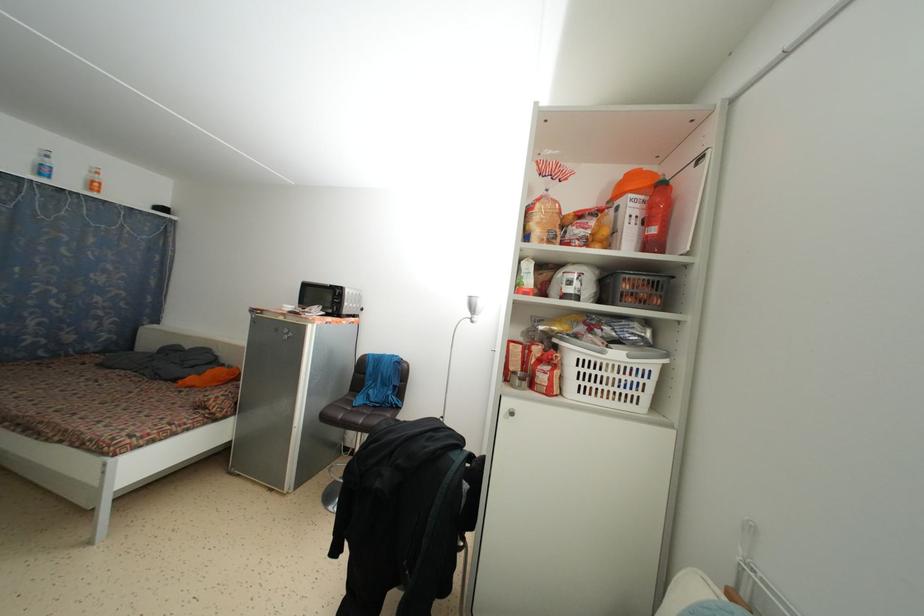
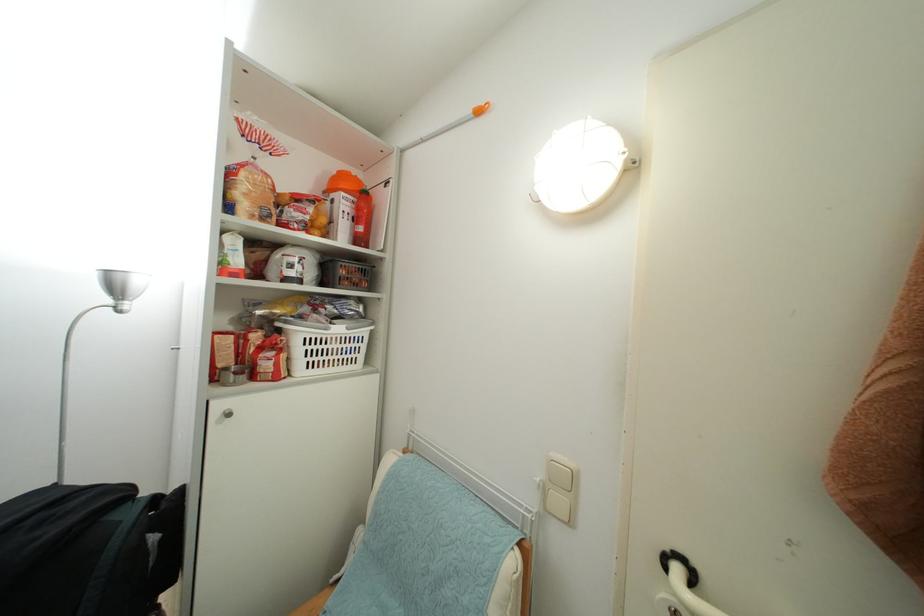
Find the pixel in the second image that matches (x=658, y=236) in the first image.

(365, 235)